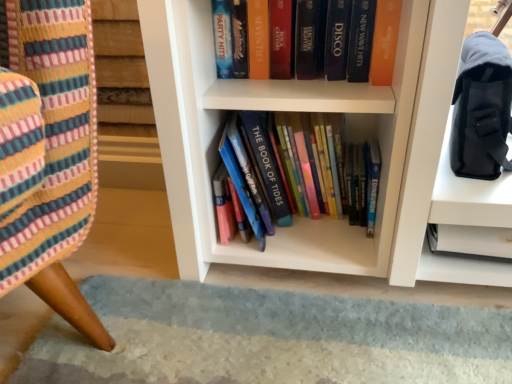
Question: Considering the relative positions of orange matte book at upper center, acting as the 2th book starting from the bottom, and black fabric shoulder bag at upper right in the image provided, is orange matte book at upper center, acting as the 2th book starting from the bottom, behind black fabric shoulder bag at upper right?

Choices:
 (A) yes
 (B) no

Answer: (A)

Question: Is orange matte book at upper center, which is counted as the first book, starting from the top, turned away from black fabric shoulder bag at upper right?

Choices:
 (A) yes
 (B) no

Answer: (B)

Question: Can you confirm if orange matte book at upper center, which is counted as the first book, starting from the top, is taller than black fabric shoulder bag at upper right?

Choices:
 (A) no
 (B) yes

Answer: (A)

Question: Can you confirm if orange matte book at upper center, acting as the 2th book starting from the bottom, is positioned to the left of black fabric shoulder bag at upper right?

Choices:
 (A) no
 (B) yes

Answer: (B)

Question: Are orange matte book at upper center, which is counted as the first book, starting from the top, and black fabric shoulder bag at upper right far apart?

Choices:
 (A) no
 (B) yes

Answer: (A)

Question: Is black fabric shoulder bag at upper right bigger or smaller than hardcover books at center, the second book in the top-to-bottom sequence?

Choices:
 (A) big
 (B) small

Answer: (B)

Question: Do you think black fabric shoulder bag at upper right is within hardcover books at center, the second book in the top-to-bottom sequence, or outside of it?

Choices:
 (A) outside
 (B) inside

Answer: (A)

Question: From the image's perspective, is black fabric shoulder bag at upper right positioned above or below hardcover books at center, the second book in the top-to-bottom sequence?

Choices:
 (A) above
 (B) below

Answer: (A)

Question: From a real-world perspective, relative to hardcover books at center, which is the 1th book in bottom-to-top order, is black fabric shoulder bag at upper right vertically above or below?

Choices:
 (A) above
 (B) below

Answer: (A)

Question: Would you say hardcover books at center, which is the 1th book in bottom-to-top order, is inside or outside black fabric shoulder bag at upper right?

Choices:
 (A) inside
 (B) outside

Answer: (B)

Question: In terms of height, does hardcover books at center, the second book in the top-to-bottom sequence, look taller or shorter compared to black fabric shoulder bag at upper right?

Choices:
 (A) short
 (B) tall

Answer: (B)

Question: From a real-world perspective, is hardcover books at center, the second book in the top-to-bottom sequence, positioned above or below black fabric shoulder bag at upper right?

Choices:
 (A) below
 (B) above

Answer: (A)

Question: From the image's perspective, is hardcover books at center, which is the 1th book in bottom-to-top order, positioned above or below black fabric shoulder bag at upper right?

Choices:
 (A) above
 (B) below

Answer: (B)

Question: Is point (393, 11) closer or farther from the camera than point (269, 188)?

Choices:
 (A) closer
 (B) farther

Answer: (A)

Question: Based on their positions, is orange matte book at upper center, acting as the 2th book starting from the bottom, located to the left or right of hardcover books at center, which is the 1th book in bottom-to-top order?

Choices:
 (A) right
 (B) left

Answer: (B)